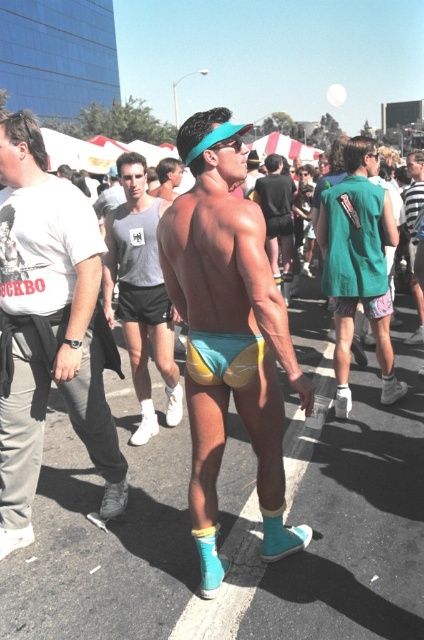
Describe the element at coordinates (228, 333) in the screenshot. The height and width of the screenshot is (640, 424). I see `matte yellow and blue shorts at center` at that location.

Can you confirm if matte yellow and blue shorts at center is taller than gray fabric shorts at center?

Yes.

The image size is (424, 640). What do you see at coordinates (228, 333) in the screenshot?
I see `matte yellow and blue shorts at center` at bounding box center [228, 333].

Where is `matte yellow and blue shorts at center`? The image size is (424, 640). matte yellow and blue shorts at center is located at coordinates (228, 333).

Is point (242, 157) less distant than point (234, 355)?

Yes, it is.

Where is `matte yellow and blue shorts at center`? Image resolution: width=424 pixels, height=640 pixels. matte yellow and blue shorts at center is located at coordinates (228, 333).

Is green fabric shorts at center behind gray fabric shorts at center?

That is True.

Looking at this image, between green fabric shorts at center and gray fabric shorts at center, which one has less height?

gray fabric shorts at center

Who is more distant from viewer, (325, 218) or (136, 225)?

The point (325, 218) is more distant.

The width and height of the screenshot is (424, 640). What are the coordinates of `green fabric shorts at center` in the screenshot? It's located at (359, 266).